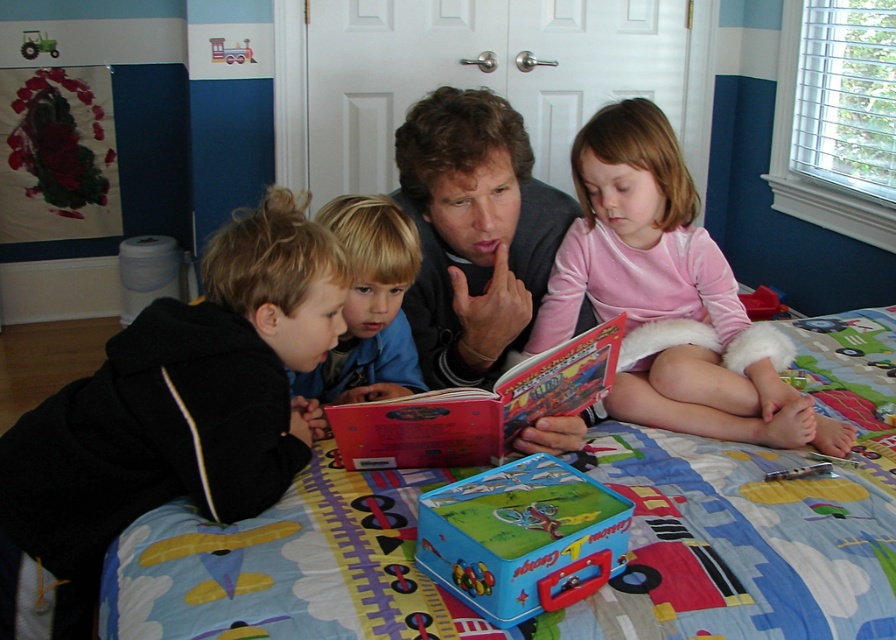
You are a photographer holding a camera. You want to take a photo of the hardcover book at center from a distance that allows you to capture the entire book without zooming in. The camera has a maximum focus range of 1 meter. Can you take the photo from your current position?

The hardcover book at center and camera are 1.21 meters apart. Since the camera can only focus up to 1 meter, you need to move closer to ensure the entire book is in focus.

You are a parent trying to find the hardcover book at center in your child bedroom. The room has a two tone wall with deep blue lower half and white upper half. You see a point marked at coordinate (x=477, y=408). Where is the hardcover book at center located in relation to the two tone wall?

The point at coordinate (x=477, y=408) indicates the location of the hardcover book at center, which is positioned on the white upper half of the two tone wall in the child bedroom.

You are a tailor trying to fix a button on the blue cotton shirt at center. The button is on the matte black sweater at center. Which clothing item should you look under to find the button?

The matte black sweater at center is located above the blue cotton shirt at center, so the button from the matte black sweater at center would be found under the matte black sweater at center.